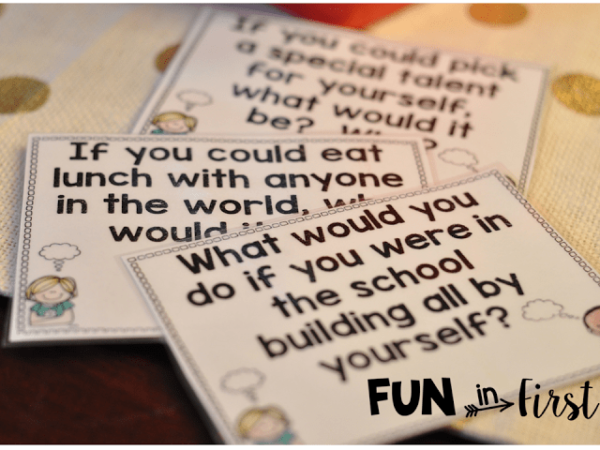
Locate an element on the screen. The height and width of the screenshot is (450, 600). tablecloth is located at coordinates (543, 20).